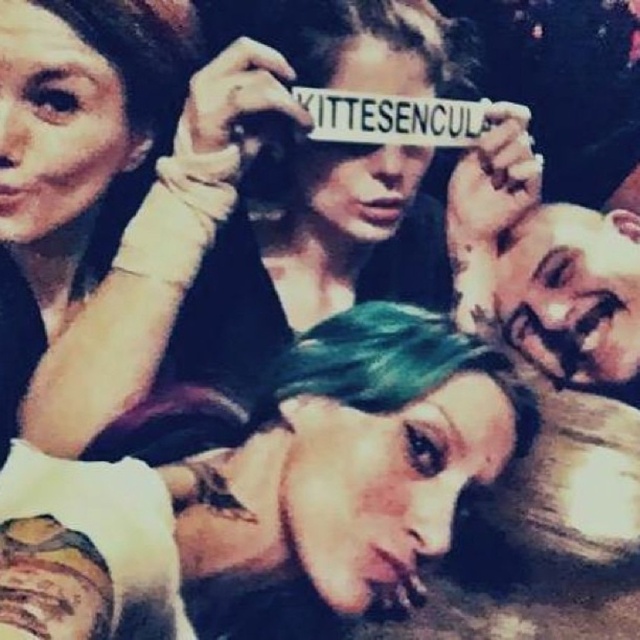
You are taking a photo of the teal hair at center and the green hair at lower right. Which hair color is positioned closer to the camera?

The teal hair at center is closer to the viewer than the green hair at lower right, so the teal hair at center is positioned closer to the camera.